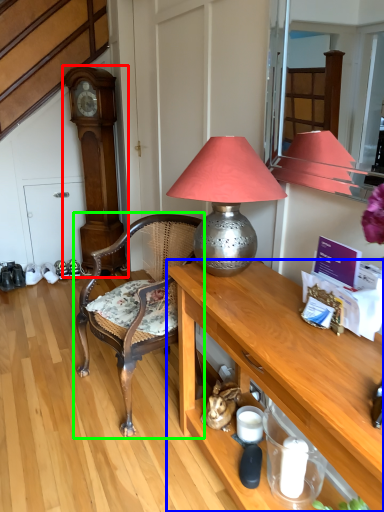
Question: Based on their relative distances, which object is farther from clock (highlighted by a red box)? Choose from desk (highlighted by a blue box) and chair (highlighted by a green box).

Choices:
 (A) desk
 (B) chair

Answer: (A)